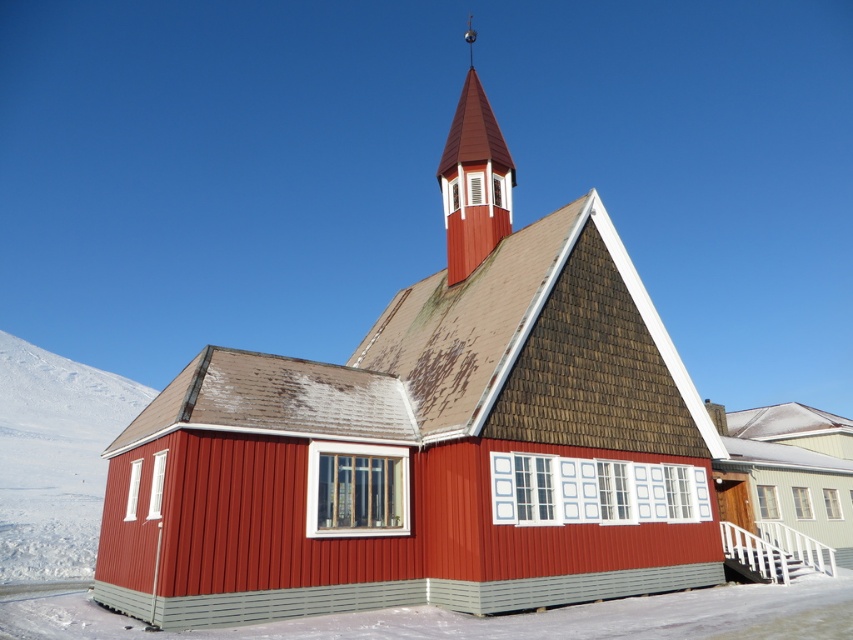
Looking at this image, you are an architect designing a new garden layout around the smooth wooden chapel at center and the smooth red wood spire at upper center. If you want to place a flower bed between them, which object should the flower bed be closer to? Please consider their widths.

The flower bed should be closer to the smooth red wood spire at upper center because the smooth wooden chapel at center is wider than the smooth red wood spire at upper center, so the spire requires less space between them.

You are standing in front of the red wooden church and notice two points marked on its steeple. The first point is at coordinates point (x=277, y=381) and the second is at point (x=469, y=177). From your perspective, which point is closer to you?

Point (x=277, y=381) is in front of point (x=469, y=177), so the first point is closer to you.

What are the coordinates of the smooth wooden chapel at center in the image?

The smooth wooden chapel at center is located at coordinates point (430, 440).